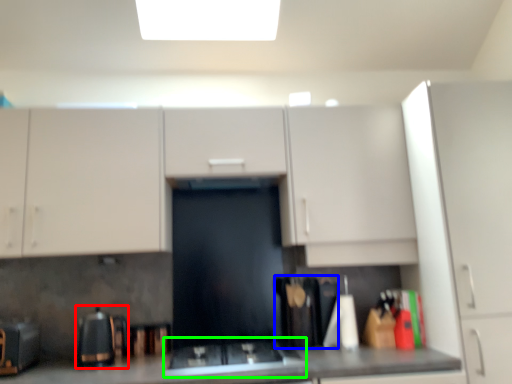
Question: Considering the real-world distances, which object is farthest from appliance (highlighted by a red box)? appliance (highlighted by a blue box) or gas stove (highlighted by a green box)?

Choices:
 (A) appliance
 (B) gas stove

Answer: (A)